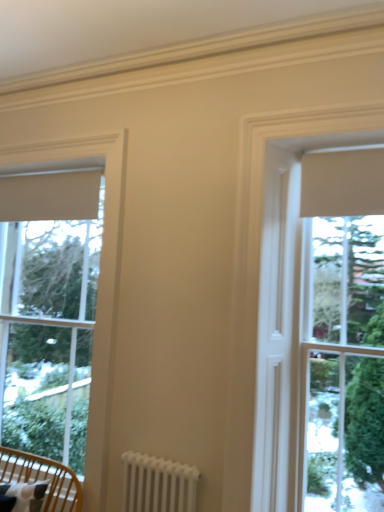
Question: From the image's perspective, is white matte window at center on white metal radiator at lower center?

Choices:
 (A) yes
 (B) no

Answer: (A)

Question: Is white matte window at center shorter than white metal radiator at lower center?

Choices:
 (A) yes
 (B) no

Answer: (B)

Question: Does white matte window at center have a lesser width compared to white metal radiator at lower center?

Choices:
 (A) yes
 (B) no

Answer: (A)

Question: Is white matte window at center facing away from white metal radiator at lower center?

Choices:
 (A) no
 (B) yes

Answer: (A)

Question: From the image's perspective, is white matte window at center located beneath white metal radiator at lower center?

Choices:
 (A) yes
 (B) no

Answer: (B)

Question: Does white matte window at center have a smaller size compared to white metal radiator at lower center?

Choices:
 (A) no
 (B) yes

Answer: (A)

Question: Is white matte window at center outside of wooden chair with cushion at lower left?

Choices:
 (A) no
 (B) yes

Answer: (B)

Question: Is white matte window at center in contact with wooden chair with cushion at lower left?

Choices:
 (A) yes
 (B) no

Answer: (B)

Question: Does white matte window at center have a lesser height compared to wooden chair with cushion at lower left?

Choices:
 (A) yes
 (B) no

Answer: (B)

Question: Considering the relative sizes of white matte window at center and wooden chair with cushion at lower left in the image provided, is white matte window at center taller than wooden chair with cushion at lower left?

Choices:
 (A) no
 (B) yes

Answer: (B)

Question: Is white matte window at center oriented towards wooden chair with cushion at lower left?

Choices:
 (A) no
 (B) yes

Answer: (A)

Question: Is wooden chair with cushion at lower left at the back of white matte window at center?

Choices:
 (A) no
 (B) yes

Answer: (A)

Question: Is white matte window at left completely or partially outside of white matte window at center?

Choices:
 (A) no
 (B) yes

Answer: (B)